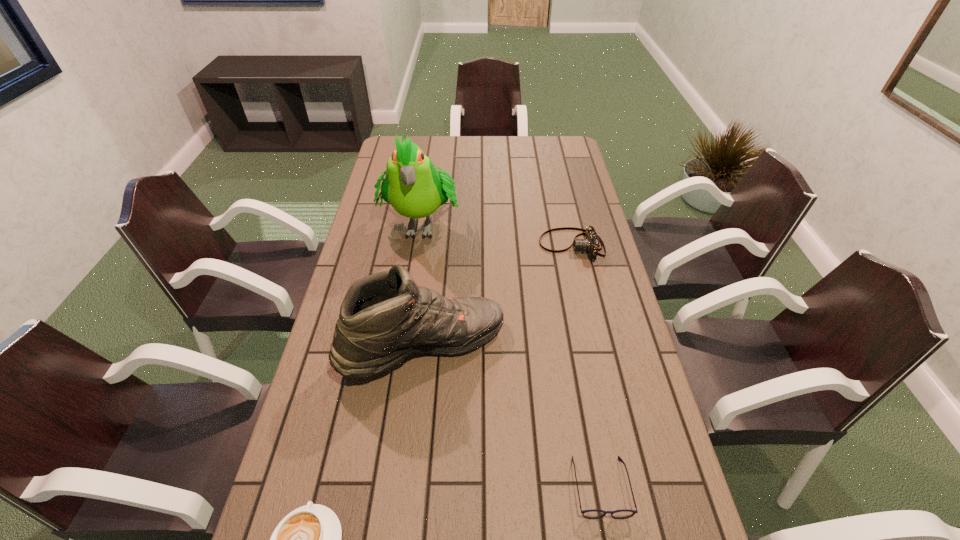
Locate an element on the screen. The width and height of the screenshot is (960, 540). parakeet that is at the left edge is located at coordinates (412, 185).

Where is `ski boot positioned at the left edge`? The width and height of the screenshot is (960, 540). ski boot positioned at the left edge is located at coordinates (385, 317).

Where is `camera located in the right edge section of the desktop`? This screenshot has height=540, width=960. camera located in the right edge section of the desktop is located at coordinates (590, 244).

Locate an element on the screen. This screenshot has width=960, height=540. spectacles that is positioned at the right edge is located at coordinates (593, 513).

Where is `vacant space at the far edge of the desktop`? The width and height of the screenshot is (960, 540). vacant space at the far edge of the desktop is located at coordinates (447, 138).

At what (x,y) coordinates should I click in order to perform the action: click on vacant space at the left edge. Please return your answer as a coordinate pair (x, y). Looking at the image, I should click on (379, 221).

Find the location of `vacant space at the right edge of the desktop`. vacant space at the right edge of the desktop is located at coordinates (570, 212).

What are the coordinates of `vacant space at the far left corner of the desktop` in the screenshot? It's located at (396, 136).

Image resolution: width=960 pixels, height=540 pixels. I want to click on vacant area at the far right corner of the desktop, so click(x=569, y=137).

The image size is (960, 540). In order to click on free point between the shortest object and the tallest object in this screenshot , I will do `click(511, 355)`.